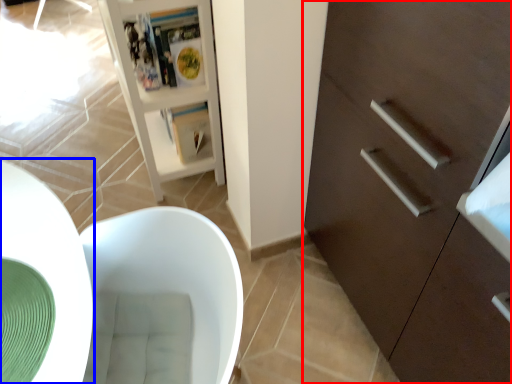
Question: Among these objects, which one is nearest to the camera, cabinetry (highlighted by a red box) or round table (highlighted by a blue box)?

Choices:
 (A) cabinetry
 (B) round table

Answer: (B)